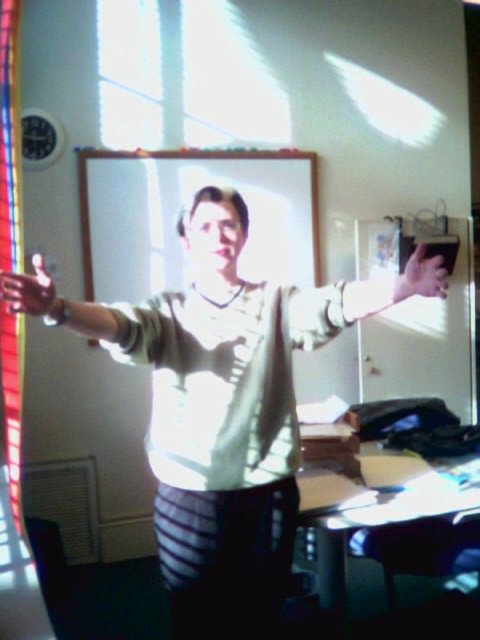
You are an assistant who needs to locate a specific point in the image. The scene has a person standing with arms outstretched near a whiteboard. Can you identify which object is at the point labeled as point (360, 300)?

The matte white hand at upper right is located at point (360, 300).

You are standing in the classroom and want to determine which of the two points, point [299,344] or point [40,284], is closer to you. Based on the image, which point is nearer?

Point [299,344] is closer to you because it is further to the viewer than point [40,284].

From the picture: You are standing in a classroom and see two points marked on the wall. The first point is at coordinates point (309, 337) and the second is at point (439, 285). Which point is closer to you?

Point (439, 285) is closer to you because it is in front of point (309, 337).